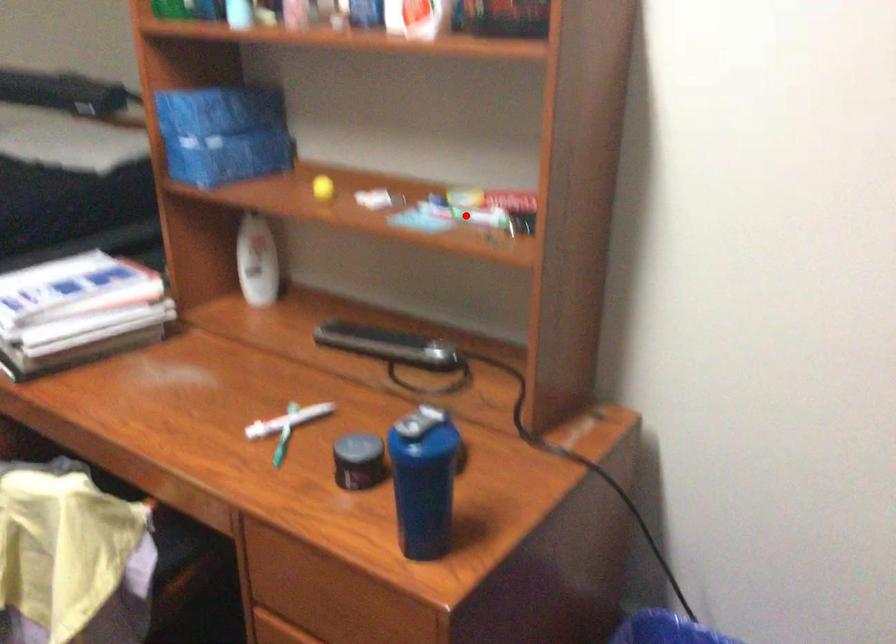
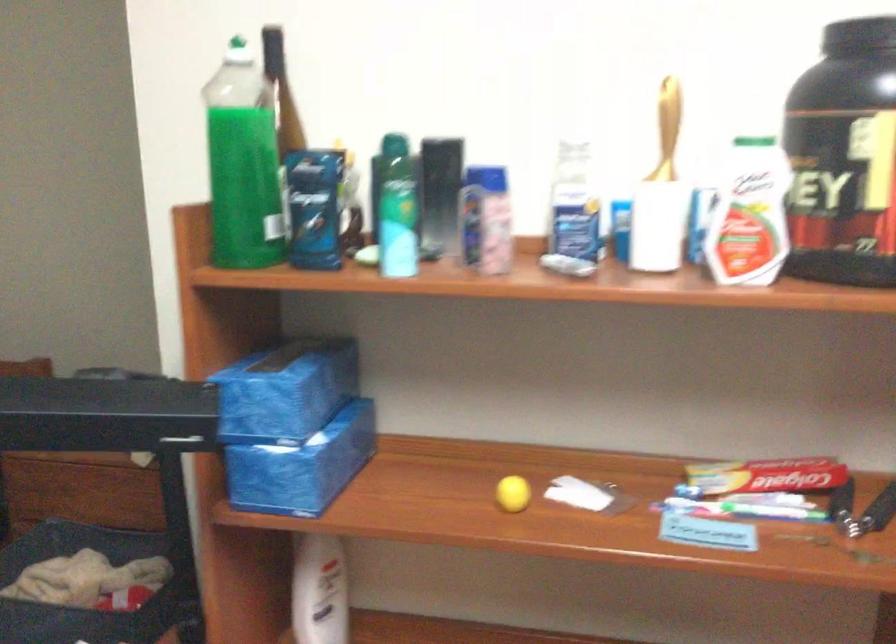
Question: A red point is marked in image1. In image2, is the corresponding 3D point closer to the camera or farther? Reply with the corresponding letter.

Choices:
 (A) The corresponding 3D point is closer.
 (B) The corresponding 3D point is farther.

Answer: (A)